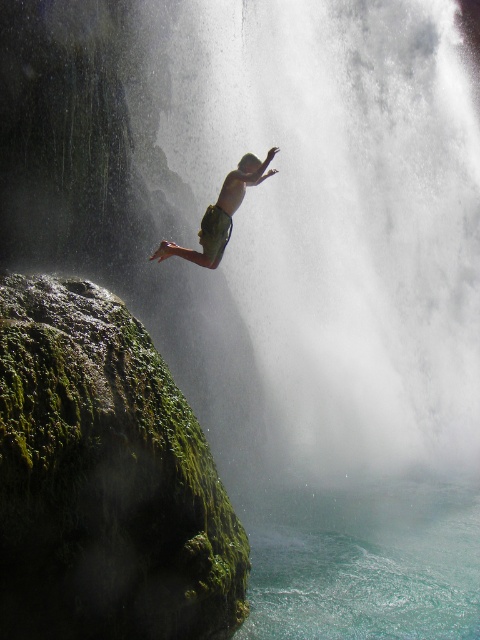
Question: Is turquoise liquid at lower center to the left of green fabric shorts at center from the viewer's perspective?

Choices:
 (A) no
 (B) yes

Answer: (A)

Question: Which point appears closest to the camera in this image?

Choices:
 (A) (60, 429)
 (B) (465, 595)

Answer: (A)

Question: Can you confirm if turquoise liquid at lower center is positioned below green fabric shorts at center?

Choices:
 (A) yes
 (B) no

Answer: (A)

Question: Where is green mossy rock at left located in relation to turquoise liquid at lower center in the image?

Choices:
 (A) below
 (B) above

Answer: (B)

Question: Which of the following is the farthest from the observer?

Choices:
 (A) green fabric shorts at center
 (B) turquoise liquid at lower center
 (C) green mossy rock at left

Answer: (A)

Question: Which point is farther from the camera taking this photo?

Choices:
 (A) (210, 211)
 (B) (192, 426)
 (C) (312, 620)

Answer: (A)